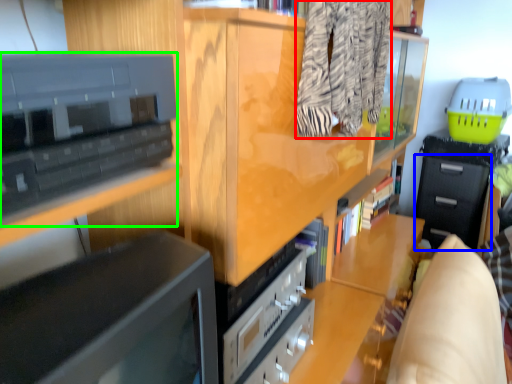
Question: Which is nearer to the clothing (highlighted by a red box)? drawer (highlighted by a blue box) or cabinetry (highlighted by a green box).

Choices:
 (A) drawer
 (B) cabinetry

Answer: (B)